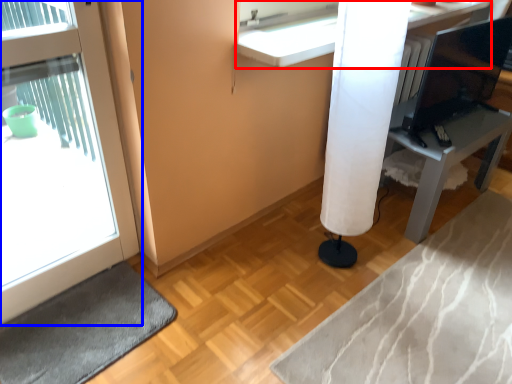
Question: Which object appears farthest to the camera in this image, counter (highlighted by a red box) or door (highlighted by a blue box)?

Choices:
 (A) counter
 (B) door

Answer: (A)